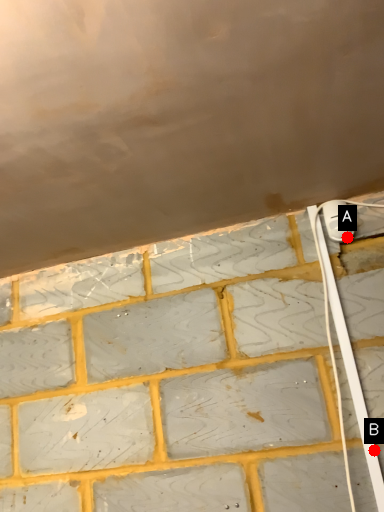
Question: Two points are circled on the image, labeled by A and B beside each circle. Among these points, which one is nearest to the camera?

Choices:
 (A) A is closer
 (B) B is closer

Answer: (B)